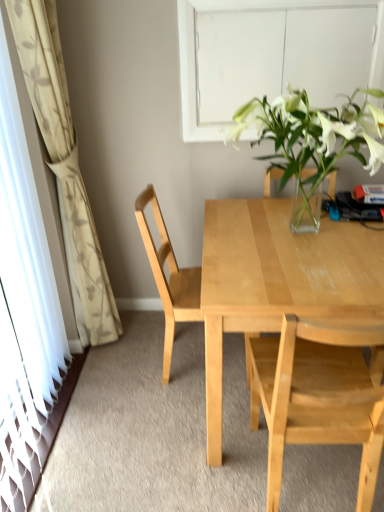
The width and height of the screenshot is (384, 512). I want to click on free location in front of white floral-patterned curtain at left, so click(x=110, y=397).